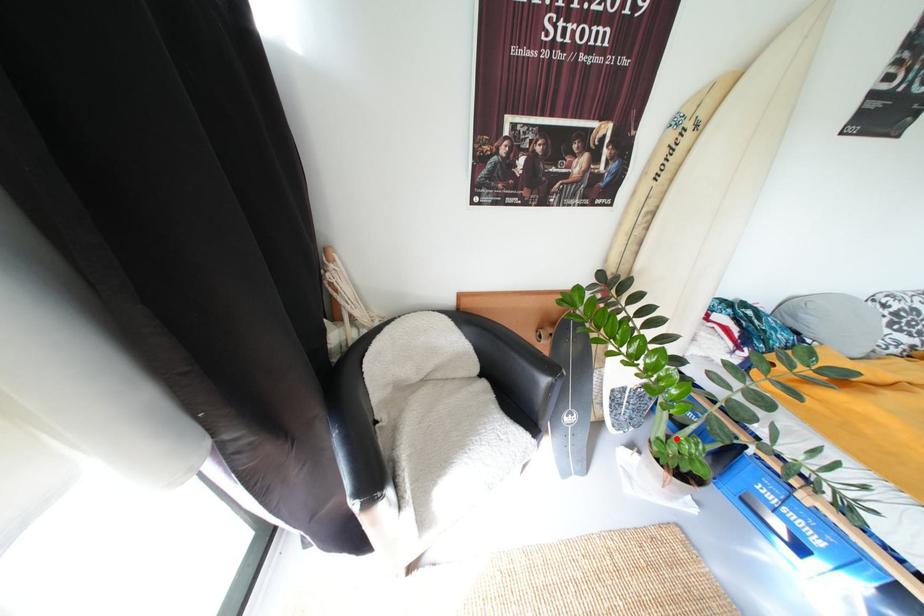
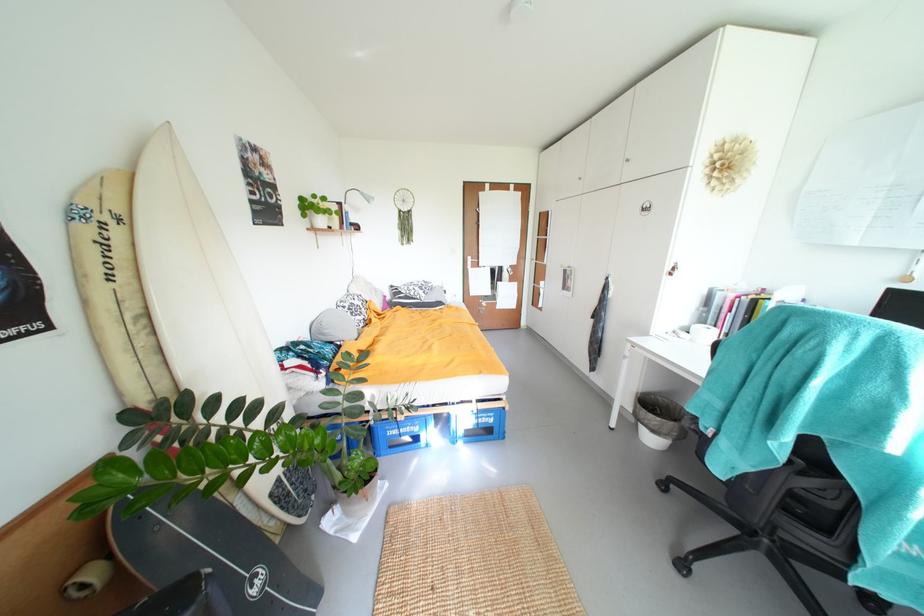
Find the pixel in the second image that matches the highlighted location in the first image.

(347, 471)